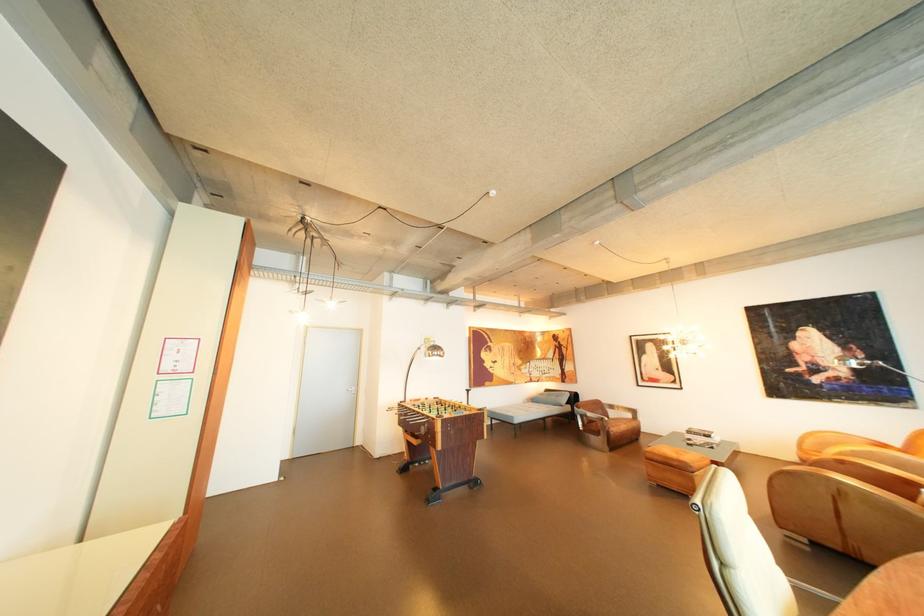
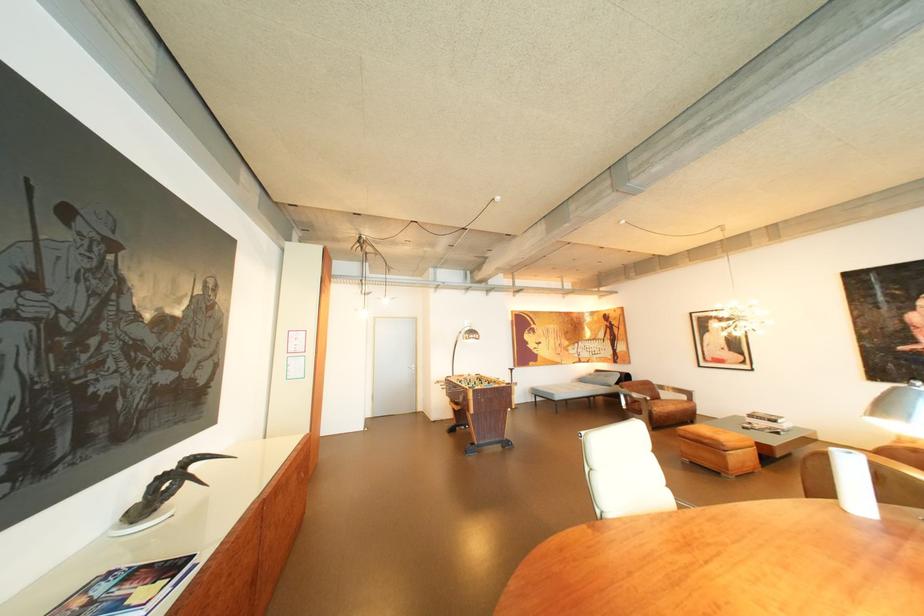
Question: The camera is either moving clockwise (left) or counter-clockwise (right) around the object. The first image is from the beginning of the video and the second image is from the end. Is the camera moving left or right when shooting the video?

Choices:
 (A) Left
 (B) Right

Answer: (B)